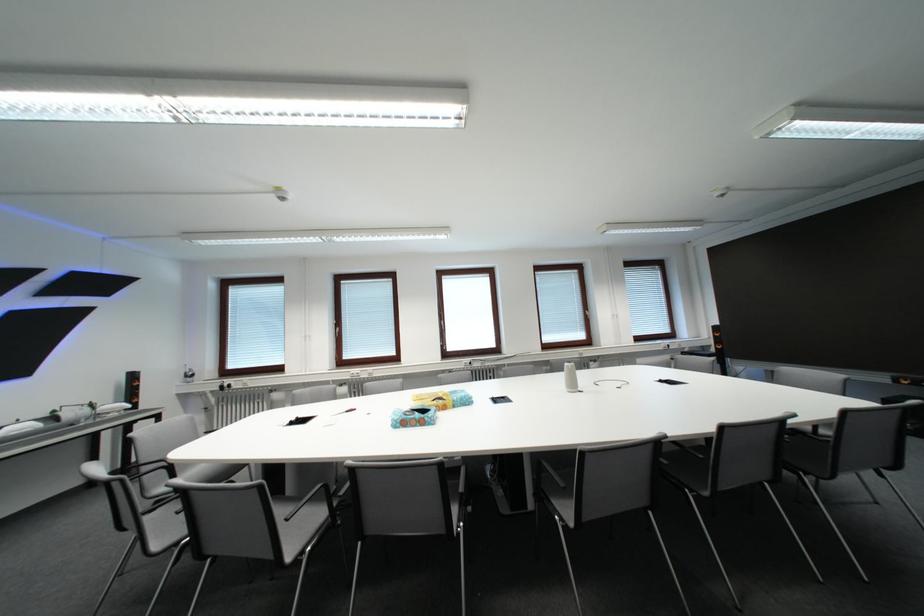
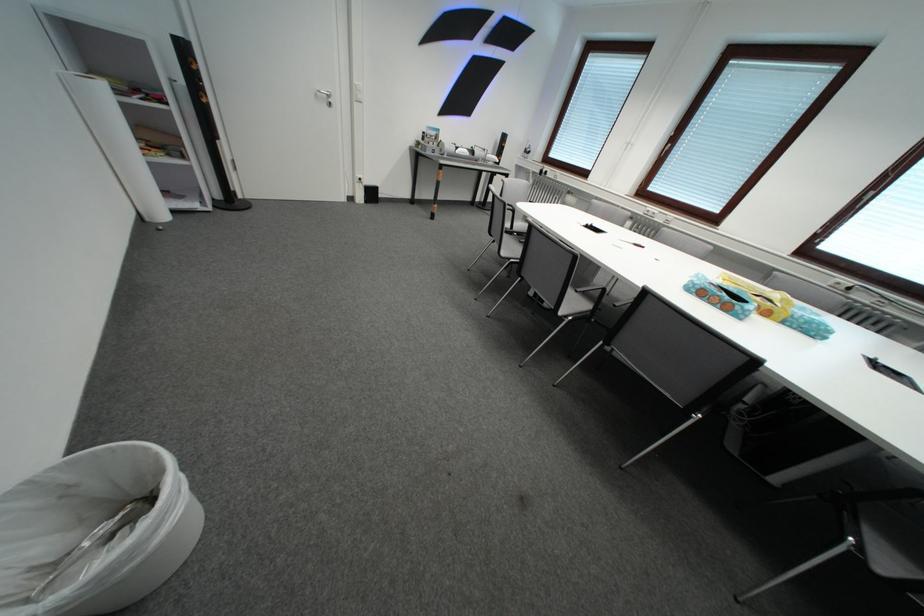
Locate, in the second image, the point that corresponds to [455,410] in the first image.

(776, 315)